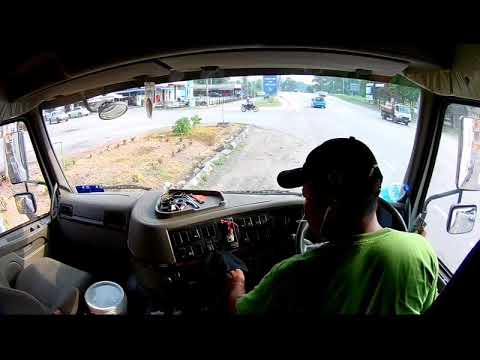
Where is `window`? window is located at coordinates (450, 154), (34, 166).